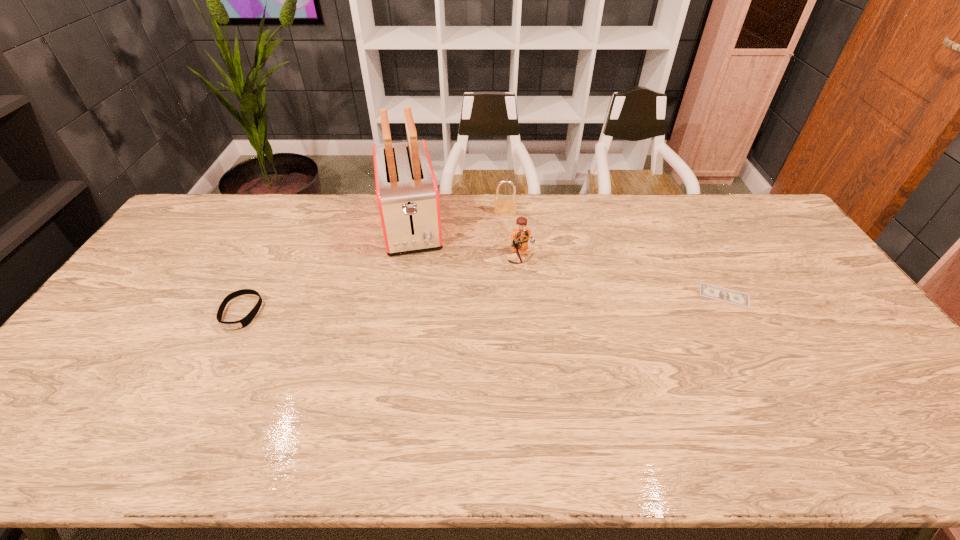
The width and height of the screenshot is (960, 540). I want to click on free point located 0.240m on the front-facing side of the padlock, so click(x=504, y=259).

What are the coordinates of `vacant point located on the front-facing side of the padlock` in the screenshot? It's located at (503, 267).

At what (x,y) coordinates should I click in order to perform the action: click on vacant region located on the front-facing side of the padlock. Please return your answer as a coordinate pair (x, y). Looking at the image, I should click on (503, 272).

This screenshot has width=960, height=540. Find the location of `vacant region located on the front-facing side of the toaster`. vacant region located on the front-facing side of the toaster is located at coordinates (422, 334).

You are a GUI agent. You are given a task and a screenshot of the screen. Output one action in this format:
    pyautogui.click(x=<x>, y=<y>)
    Task: Click on the free region located on the front-facing side of the toaster
    The image size is (960, 540).
    Given the screenshot: What is the action you would take?
    pyautogui.click(x=415, y=279)

I want to click on vacant space situated 0.250m on the front-facing side of the toaster, so click(x=420, y=318).

At what (x,y) coordinates should I click in order to perform the action: click on vacant position located 0.180m holding a crossbow in the hands of the Lego. Please return your answer as a coordinate pair (x, y). The height and width of the screenshot is (540, 960). Looking at the image, I should click on (554, 312).

Find the location of `vacant point located 0.060m holding a crossbow in the hands of the Lego`. vacant point located 0.060m holding a crossbow in the hands of the Lego is located at coordinates (536, 284).

Where is `free space located 0.260m holding a crossbow in the hands of the Lego`? This screenshot has height=540, width=960. free space located 0.260m holding a crossbow in the hands of the Lego is located at coordinates (568, 332).

You are a GUI agent. You are given a task and a screenshot of the screen. Output one action in this format:
    pyautogui.click(x=<x>, y=<y>)
    Task: Click on the padlock located in the far edge section of the desktop
    Image resolution: width=960 pixels, height=540 pixels.
    Given the screenshot: What is the action you would take?
    pyautogui.click(x=503, y=205)